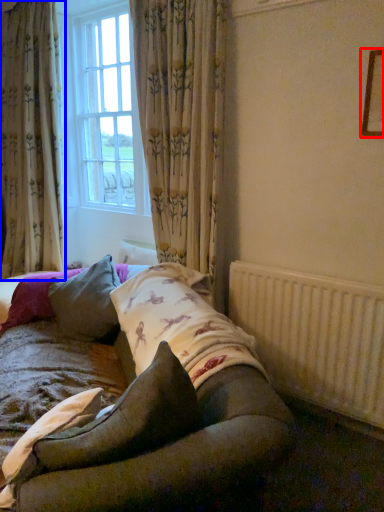
Question: Which of the following is the closest to the observer, picture frame (highlighted by a red box) or curtain (highlighted by a blue box)?

Choices:
 (A) picture frame
 (B) curtain

Answer: (A)